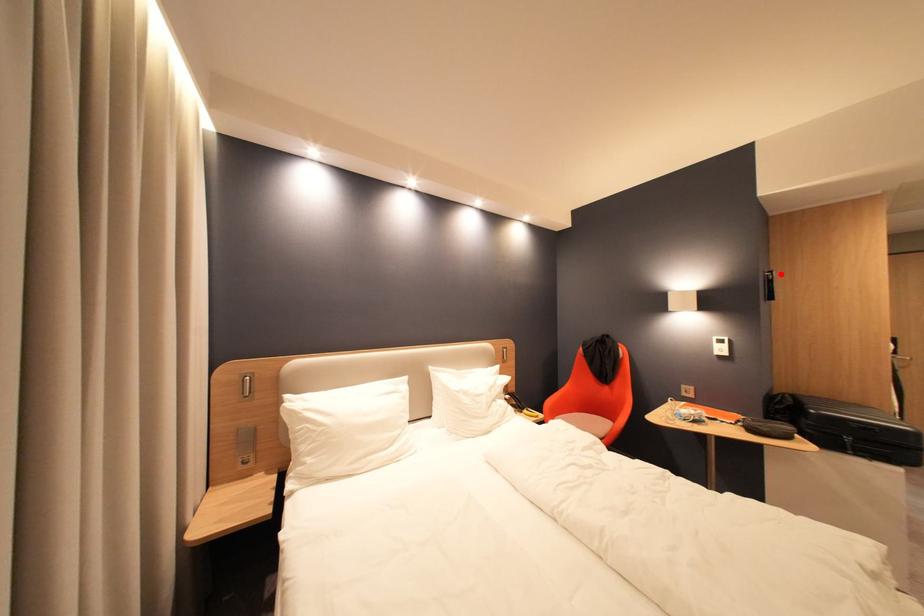
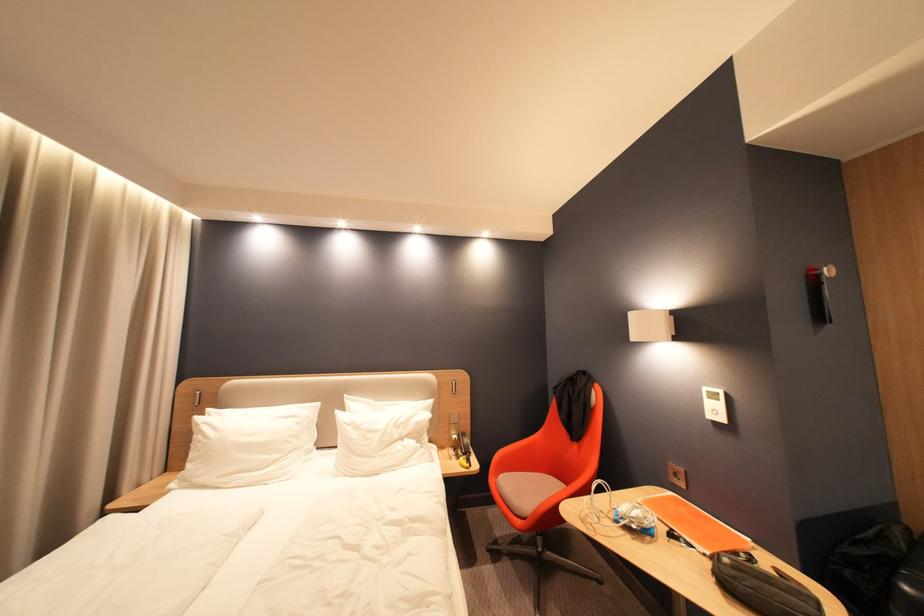
In the second image, find the point that corresponds to the highlighted location in the first image.

(830, 270)